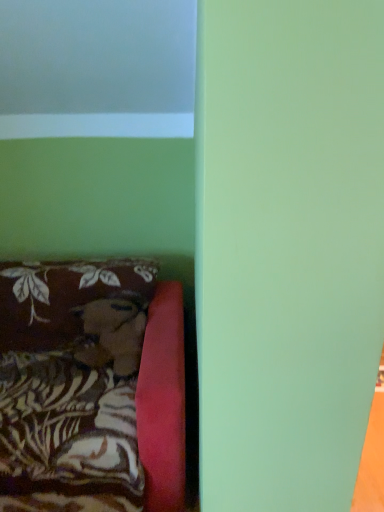
At what (x,y) coordinates should I click in order to perform the action: click on brown fabric cushion at lower left. Please return your answer as a coordinate pair (x, y). Image resolution: width=384 pixels, height=512 pixels. Looking at the image, I should click on (91, 388).

Describe the element at coordinates (91, 388) in the screenshot. I see `brown fabric cushion at lower left` at that location.

The height and width of the screenshot is (512, 384). What are the coordinates of `brown fabric cushion at lower left` in the screenshot? It's located at (91, 388).